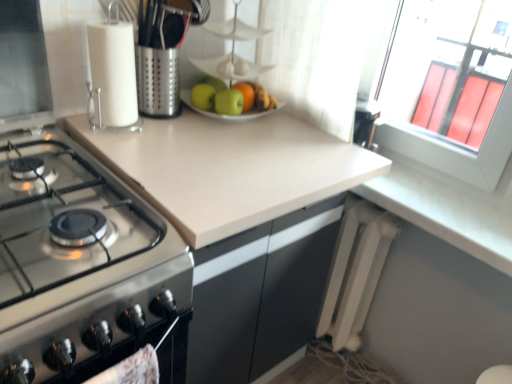
Where is `free space in front of white paper towel holder at upper left`? The height and width of the screenshot is (384, 512). free space in front of white paper towel holder at upper left is located at coordinates (121, 144).